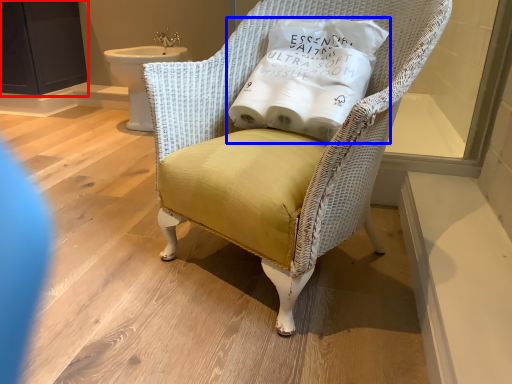
Question: Which of the following is the farthest to the observer, screen door (highlighted by a red box) or pillow (highlighted by a blue box)?

Choices:
 (A) screen door
 (B) pillow

Answer: (A)